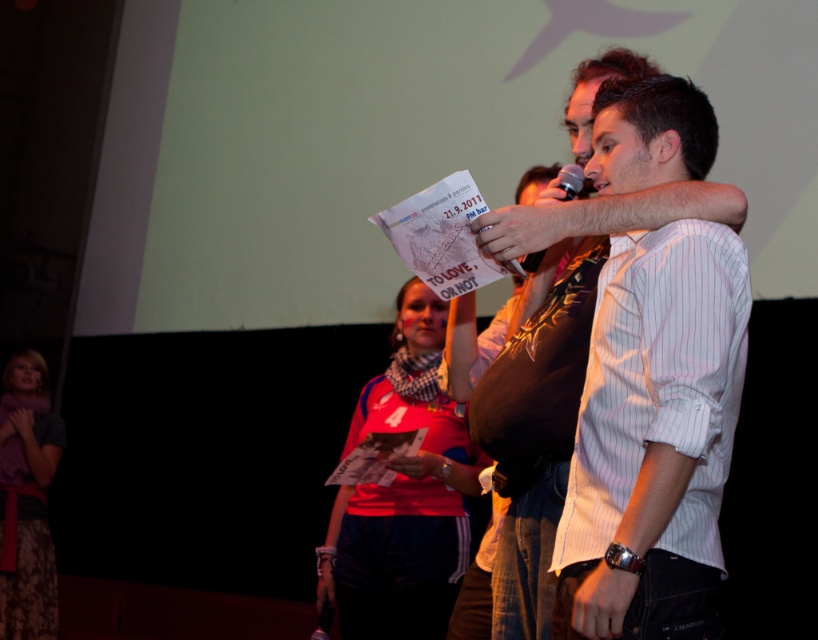
You are an attendee at this event and want to take a photo of the matte pink shirt at center and the metallic silver microphone at upper center. Which object should you focus on first to ensure both are in the frame?

You should focus on the matte pink shirt at center first because it is closer to you than the metallic silver microphone at upper center, ensuring both are in the frame.

You are a photographer in the audience of this event. You want to take a photo of the presenter wearing the white striped shirt at center. What are the coordinates where you should aim your camera?

The coordinates to aim your camera are at point (649, 132), which is where the white striped shirt at center is located.